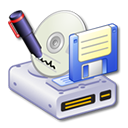
In order to click on computer disk in this screenshot , I will do `click(98, 47)`.